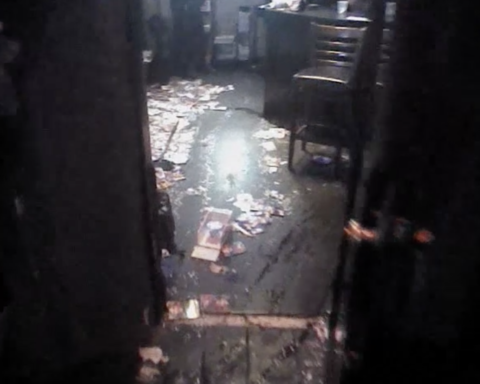
The width and height of the screenshot is (480, 384). I want to click on doorway, so click(243, 326).